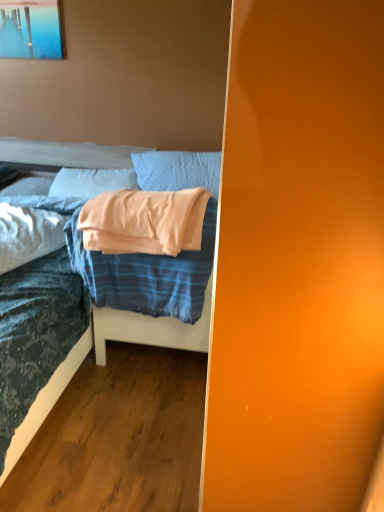
Question: In terms of width, does blue plaid bed at lower left look wider or thinner when compared to white soft pillow at upper left, arranged as the 1th pillow when viewed from the back?

Choices:
 (A) thin
 (B) wide

Answer: (B)

Question: From a real-world perspective, is blue plaid bed at lower left above or below white soft pillow at upper left, the 4th pillow positioned from the front?

Choices:
 (A) above
 (B) below

Answer: (B)

Question: Estimate the real-world distances between objects in this image. Which object is farther from the blue plaid bed at lower left?

Choices:
 (A) blue striped fabric blanket at center
 (B) white soft pillow at left, which is the 4th pillow from back to front
 (C) metallic glossy picture frame at upper left
 (D) light blue fabric pillow at upper center, the third pillow from the back
 (E) peach soft fabric pillow at center, the 2th pillow positioned from the back

Answer: (C)

Question: Estimate the real-world distances between objects in this image. Which object is farther from the light blue fabric pillow at upper center, arranged as the second pillow when viewed from the front?

Choices:
 (A) white soft pillow at upper left, the 4th pillow positioned from the front
 (B) metallic glossy picture frame at upper left
 (C) blue striped fabric blanket at center
 (D) blue plaid bed at lower left
 (E) peach soft fabric pillow at center, the 2th pillow positioned from the back

Answer: (B)